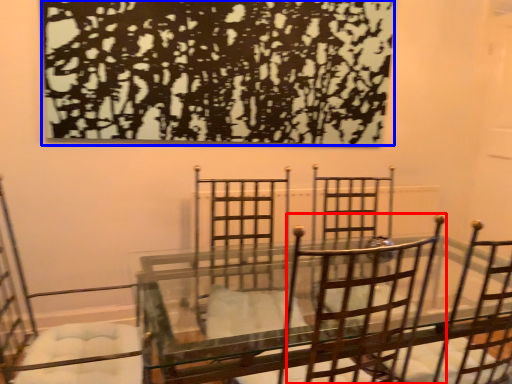
Question: Which of the following is the closest to the observer, chair (highlighted by a red box) or tree (highlighted by a blue box)?

Choices:
 (A) chair
 (B) tree

Answer: (A)